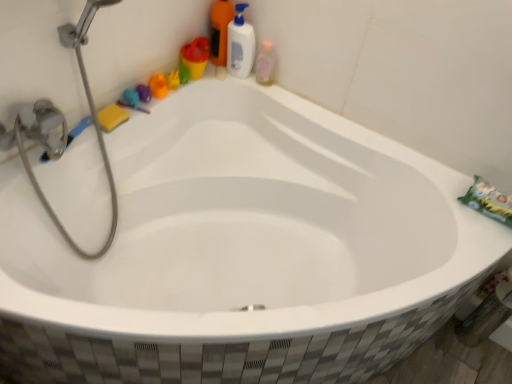
This screenshot has width=512, height=384. I want to click on matte plastic cup at upper left, so click(x=195, y=57).

Describe the element at coordinates (240, 44) in the screenshot. I see `white plastic bottle at upper right, which ranks as the 2th cleaning product in left-to-right order` at that location.

In order to face yellow sponge at upper left, should I rotate leftwards or rightwards?

You should rotate left by 18.437 degrees.

The image size is (512, 384). In order to click on rubber duck at upper left, which is the second toy from left to right in this screenshot , I will do `click(158, 86)`.

Measure the distance between yellow rubber duck at upper left, which is the third toy from left to right, and camera.

They are 5.00 feet apart.

The width and height of the screenshot is (512, 384). Describe the element at coordinates (173, 80) in the screenshot. I see `yellow rubber duck at upper left, which appears as the 1th toy when viewed from the right` at that location.

Identify the location of translucent plastic bottle at upper right, which is counted as the second cleaning product, starting from the right. The width and height of the screenshot is (512, 384). (220, 31).

Is white plastic bottle at upper right, which ranks as the 2th cleaning product in left-to-right order, wider or thinner than rubber duck at upper left, placed as the third toy when sorted from right to left?

Clearly, white plastic bottle at upper right, which ranks as the 2th cleaning product in left-to-right order, has more width compared to rubber duck at upper left, placed as the third toy when sorted from right to left.

From a real-world perspective, which is physically below, white plastic bottle at upper right, which ranks as the 2th cleaning product in left-to-right order, or rubber duck at upper left, placed as the third toy when sorted from right to left?

rubber duck at upper left, placed as the third toy when sorted from right to left, from a real-world perspective.

In the scene shown: Are white plastic bottle at upper right, which ranks as the 2th cleaning product in left-to-right order, and rubber duck at upper left, placed as the 1th toy when sorted from left to right, located far from each other?

They are positioned close to each other.

Is white plastic bottle at upper right, which ranks as the 2th cleaning product in left-to-right order, facing away from rubber duck at upper left, placed as the 1th toy when sorted from left to right?

That's not correct — white plastic bottle at upper right, which ranks as the 2th cleaning product in left-to-right order, is not looking away from rubber duck at upper left, placed as the 1th toy when sorted from left to right.

From a real-world perspective, who is located lower, rubber duck at upper left, the 2th toy in the right-to-left sequence, or pink translucent bottle at upper right?

From a 3D spatial view, rubber duck at upper left, the 2th toy in the right-to-left sequence, is below.

Can you confirm if rubber duck at upper left, which is the second toy from left to right, is wider than pink translucent bottle at upper right?

Indeed, rubber duck at upper left, which is the second toy from left to right, has a greater width compared to pink translucent bottle at upper right.

Can you tell me how much rubber duck at upper left, the 2th toy in the right-to-left sequence, and pink translucent bottle at upper right differ in facing direction?

80.4 degrees.

In the scene shown: Is rubber duck at upper left, the 2th toy in the right-to-left sequence, positioned beyond the bounds of pink translucent bottle at upper right?

Absolutely, rubber duck at upper left, the 2th toy in the right-to-left sequence, is external to pink translucent bottle at upper right.

From the image's perspective, is white plastic bottle at upper right, which ranks as the 2th cleaning product in left-to-right order, on top of yellow sponge at upper left?

Yes, from the image's perspective, white plastic bottle at upper right, which ranks as the 2th cleaning product in left-to-right order, is above yellow sponge at upper left.

Image resolution: width=512 pixels, height=384 pixels. In the image, there is a white plastic bottle at upper right, which ranks as the 2th cleaning product in left-to-right order. In order to click on soap below it (from a real-world perspective) in this screenshot , I will do (x=112, y=117).

Are white plastic bottle at upper right, which ranks as the 2th cleaning product in left-to-right order, and yellow sponge at upper left making contact?

white plastic bottle at upper right, which ranks as the 2th cleaning product in left-to-right order, is not next to yellow sponge at upper left, and they're not touching.

Is yellow sponge at upper left completely or partially inside white plastic bottle at upper right, which ranks as the 2th cleaning product in left-to-right order?

No, yellow sponge at upper left is not a part of white plastic bottle at upper right, which ranks as the 2th cleaning product in left-to-right order.

From a real-world perspective, which is physically below, rubber duck at upper left, the 2th toy in the right-to-left sequence, or green matte toothpaste at right?

green matte toothpaste at right.

Could you tell me if rubber duck at upper left, the 2th toy in the right-to-left sequence, is turned towards green matte toothpaste at right?

Yes, rubber duck at upper left, the 2th toy in the right-to-left sequence, is aimed at green matte toothpaste at right.

Is green matte toothpaste at right completely or partially inside rubber duck at upper left, which is the second toy from left to right?

Actually, green matte toothpaste at right is outside rubber duck at upper left, which is the second toy from left to right.

Is rubber duck at upper left, which is the second toy from left to right, beside green matte toothpaste at right?

rubber duck at upper left, which is the second toy from left to right, is not next to green matte toothpaste at right, and they're not touching.

Could you tell me if pink translucent bottle at upper right is facing yellow sponge at upper left?

No.

From a real-world perspective, is pink translucent bottle at upper right positioned under yellow sponge at upper left based on gravity?

No, from a real-world perspective, pink translucent bottle at upper right is not beneath yellow sponge at upper left.

Is pink translucent bottle at upper right bigger or smaller than yellow sponge at upper left?

pink translucent bottle at upper right is bigger than yellow sponge at upper left.

Image resolution: width=512 pixels, height=384 pixels. I want to click on mouthwash above the yellow sponge at upper left (from a real-world perspective), so click(x=266, y=63).

Can you confirm if yellow rubber duck at upper left, which appears as the 1th toy when viewed from the right, is taller than yellow sponge at upper left?

Correct, yellow rubber duck at upper left, which appears as the 1th toy when viewed from the right, is much taller as yellow sponge at upper left.

Considering the positions of objects yellow rubber duck at upper left, which appears as the 1th toy when viewed from the right, and yellow sponge at upper left in the image provided, who is more to the right, yellow rubber duck at upper left, which appears as the 1th toy when viewed from the right, or yellow sponge at upper left?

yellow rubber duck at upper left, which appears as the 1th toy when viewed from the right, is more to the right.

Based on their sizes in the image, would you say yellow rubber duck at upper left, which is the third toy from left to right, is bigger or smaller than yellow sponge at upper left?

yellow rubber duck at upper left, which is the third toy from left to right, is smaller than yellow sponge at upper left.

Does yellow rubber duck at upper left, which appears as the 1th toy when viewed from the right, come in front of yellow sponge at upper left?

No.

Considering the relative sizes of translucent plastic bottle at upper right, the 1th cleaning product from the left, and green matte toothpaste at right in the image provided, is translucent plastic bottle at upper right, the 1th cleaning product from the left, wider than green matte toothpaste at right?

No, translucent plastic bottle at upper right, the 1th cleaning product from the left, is not wider than green matte toothpaste at right.

Considering the points (221, 8) and (475, 194), which point is in front, point (221, 8) or point (475, 194)?

The point (475, 194) is more forward.

From the image's perspective, which is below, translucent plastic bottle at upper right, which is counted as the second cleaning product, starting from the right, or green matte toothpaste at right?

green matte toothpaste at right.

From the image's perspective, which toy is the 3rd one below the white plastic bottle at upper right, which ranks as the 2th cleaning product in left-to-right order? Please provide its 2D coordinates.

[(132, 101)]

Locate an element on the screen. This screenshot has height=384, width=512. mouthwash behind the rubber duck at upper left, which is the second toy from left to right is located at coordinates (266, 63).

Based on their spatial positions, is rubber duck at upper left, placed as the 1th toy when sorted from left to right, or yellow sponge at upper left further from matte plastic cup at upper left?

yellow sponge at upper left.

Estimate the real-world distances between objects in this image. Which object is closer to white plastic bottle at upper right, which ranks as the 2th cleaning product in left-to-right order, translucent plastic bottle at upper right, which is counted as the second cleaning product, starting from the right, or green matte toothpaste at right?

translucent plastic bottle at upper right, which is counted as the second cleaning product, starting from the right, is positioned closer to the anchor white plastic bottle at upper right, which ranks as the 2th cleaning product in left-to-right order.

When comparing their distances from green matte toothpaste at right, does rubber duck at upper left, placed as the 1th toy when sorted from left to right, or pink translucent bottle at upper right seem further?

rubber duck at upper left, placed as the 1th toy when sorted from left to right.

Considering their positions, is rubber duck at upper left, placed as the 1th toy when sorted from left to right, positioned closer to rubber duck at upper left, the 2th toy in the right-to-left sequence, than translucent plastic bottle at upper right, the 1th cleaning product from the left?

Based on the image, rubber duck at upper left, placed as the 1th toy when sorted from left to right, appears to be nearer to rubber duck at upper left, the 2th toy in the right-to-left sequence.

Looking at the image, which one is located further to pink translucent bottle at upper right, yellow sponge at upper left or translucent plastic bottle at upper right, which is counted as the second cleaning product, starting from the right?

yellow sponge at upper left is positioned further to the anchor pink translucent bottle at upper right.

Looking at the image, which one is located closer to white plastic bottle at upper right, the first cleaning product in the right-to-left sequence, yellow rubber duck at upper left, which is the third toy from left to right, or rubber duck at upper left, placed as the third toy when sorted from right to left?

The object closer to white plastic bottle at upper right, the first cleaning product in the right-to-left sequence, is yellow rubber duck at upper left, which is the third toy from left to right.

Based on their spatial positions, is matte plastic cup at upper left or pink translucent bottle at upper right closer to rubber duck at upper left, placed as the third toy when sorted from right to left?

matte plastic cup at upper left.

Estimate the real-world distances between objects in this image. Which object is further from white plastic bottle at upper right, the first cleaning product in the right-to-left sequence, rubber duck at upper left, which is the second toy from left to right, or green matte toothpaste at right?

green matte toothpaste at right is further to white plastic bottle at upper right, the first cleaning product in the right-to-left sequence.

Identify the location of toy that lies between translucent plastic bottle at upper right, which is counted as the second cleaning product, starting from the right, and rubber duck at upper left, which is the second toy from left to right, from top to bottom. Image resolution: width=512 pixels, height=384 pixels. (173, 80).

Locate an element on the screen. mouthwash situated between yellow rubber duck at upper left, which appears as the 1th toy when viewed from the right, and green matte toothpaste at right from left to right is located at coordinates pyautogui.click(x=266, y=63).

At what (x,y) coordinates should I click in order to perform the action: click on toiletry between yellow sponge at upper left and green matte toothpaste at right. Please return your answer as a coordinate pair (x, y). Image resolution: width=512 pixels, height=384 pixels. Looking at the image, I should click on (195, 57).

This screenshot has width=512, height=384. I want to click on toiletry between rubber duck at upper left, which is the second toy from left to right, and white plastic bottle at upper right, which ranks as the 2th cleaning product in left-to-right order, from left to right, so click(195, 57).